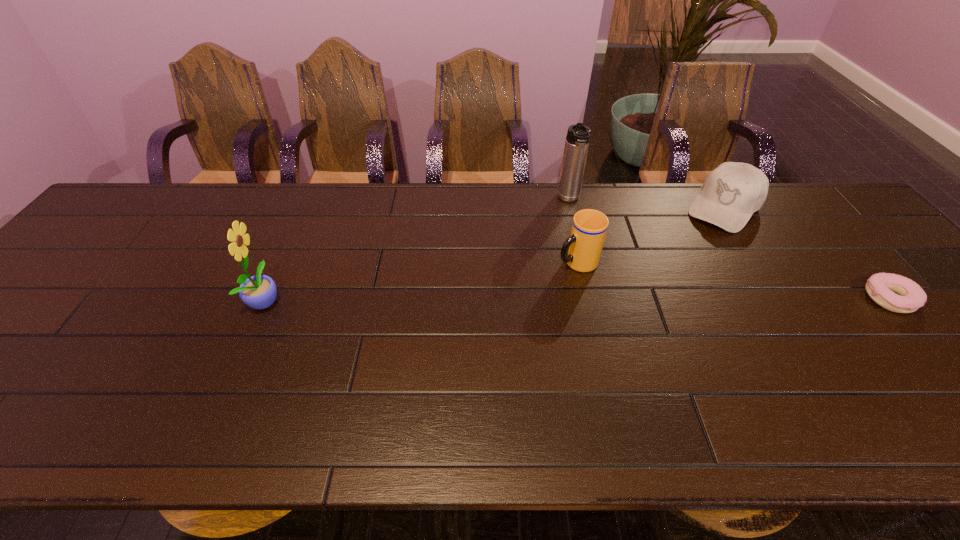
This screenshot has height=540, width=960. I want to click on vacant space on the desktop that is between the leftmost object and the rightmost object and is positioned on the side of the cup with the handle, so (x=493, y=300).

What are the coordinates of `free spot on the desktop that is between the sunflower and the rightmost object and is positioned on the front-facing side of the baseball cap` in the screenshot? It's located at (648, 299).

Locate an element on the screen. The height and width of the screenshot is (540, 960). free spot on the desktop that is between the leftmost object and the rightmost object and is positioned on the handle side of the thermos bottle is located at coordinates (588, 299).